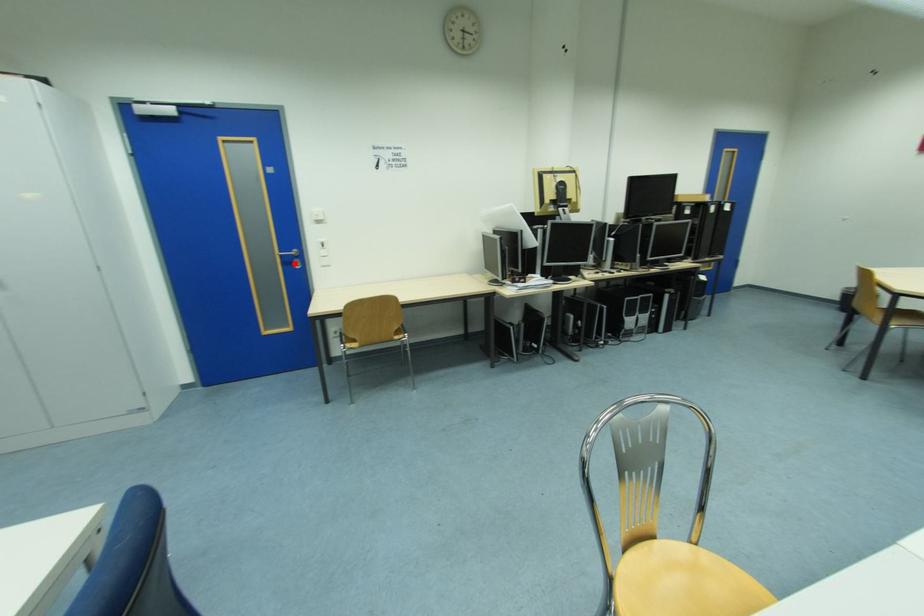
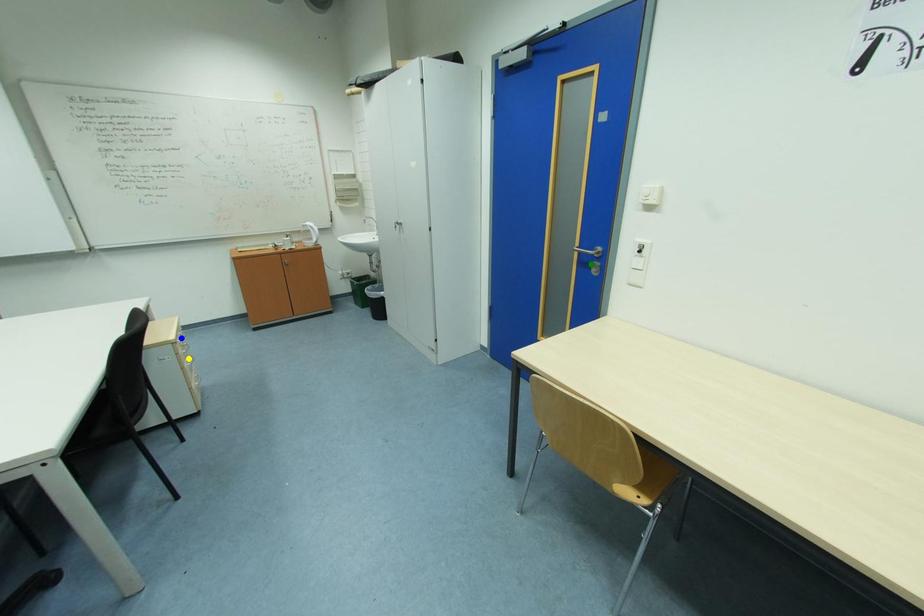
Question: I am providing you with two images of the same scene from different viewpoints. A red point is marked on the first image. You are given multiple points on the second image. Which mark in image 2 goes with the point in image 1?

Choices:
 (A) green point
 (B) yellow point
 (C) blue point

Answer: (A)